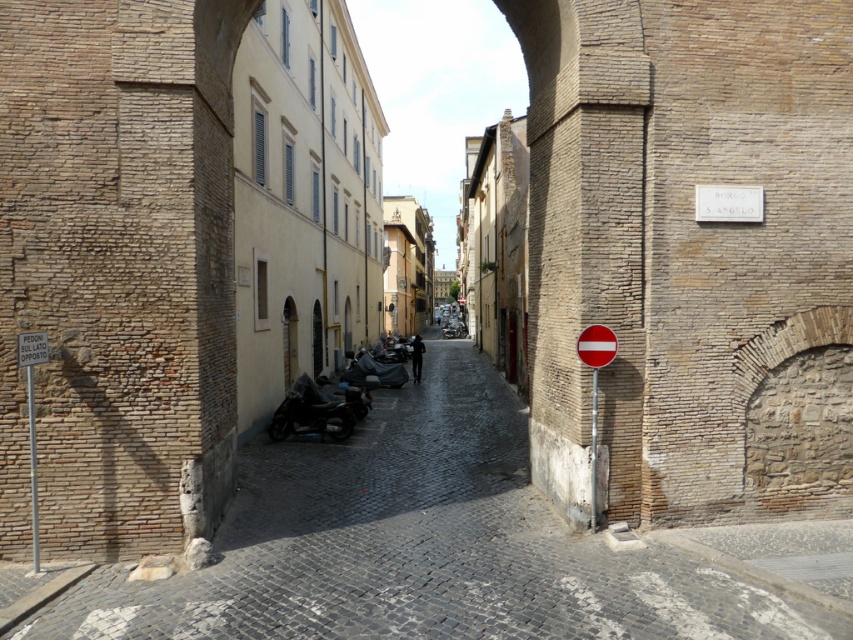
You are a tourist standing on the brick cobblestone alley at center and want to read the white plastic sign at left. Can you see the entire sign without moving your head?

The brick cobblestone alley at center is taller than the white plastic sign at left, so yes, you can see the entire sign without moving your head.